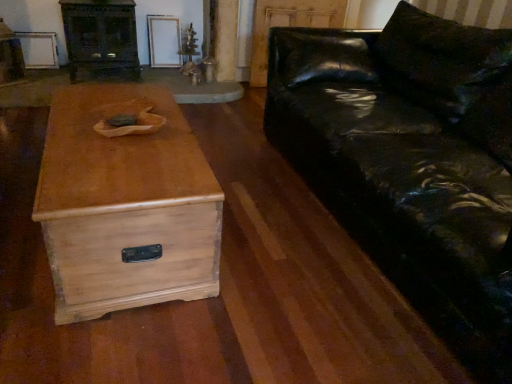
Question: Does dark wood entertainment center at upper left come behind light wood chest at center?

Choices:
 (A) no
 (B) yes

Answer: (B)

Question: Does dark wood entertainment center at upper left have a lesser height compared to light wood chest at center?

Choices:
 (A) no
 (B) yes

Answer: (A)

Question: From a real-world perspective, is dark wood entertainment center at upper left over light wood chest at center?

Choices:
 (A) yes
 (B) no

Answer: (A)

Question: Considering the relative sizes of dark wood entertainment center at upper left and light wood chest at center in the image provided, is dark wood entertainment center at upper left taller than light wood chest at center?

Choices:
 (A) yes
 (B) no

Answer: (A)

Question: Considering the relative sizes of dark wood entertainment center at upper left and light wood chest at center in the image provided, is dark wood entertainment center at upper left thinner than light wood chest at center?

Choices:
 (A) no
 (B) yes

Answer: (B)

Question: From the image's perspective, is dark wood entertainment center at upper left on top of light wood chest at center?

Choices:
 (A) no
 (B) yes

Answer: (B)

Question: Does light wood chest at center contain dark wood entertainment center at upper left?

Choices:
 (A) yes
 (B) no

Answer: (B)

Question: Is light wood chest at center not near dark wood entertainment center at upper left?

Choices:
 (A) yes
 (B) no

Answer: (A)

Question: From a real-world perspective, is light wood chest at center on top of dark wood entertainment center at upper left?

Choices:
 (A) no
 (B) yes

Answer: (A)

Question: Can you confirm if light wood chest at center is wider than dark wood entertainment center at upper left?

Choices:
 (A) yes
 (B) no

Answer: (A)

Question: Is light wood chest at center with dark wood entertainment center at upper left?

Choices:
 (A) yes
 (B) no

Answer: (B)

Question: Is light wood chest at center facing away from dark wood entertainment center at upper left?

Choices:
 (A) yes
 (B) no

Answer: (B)

Question: Would you consider glossy black leather couch at right to be distant from dark wood entertainment center at upper left?

Choices:
 (A) no
 (B) yes

Answer: (B)